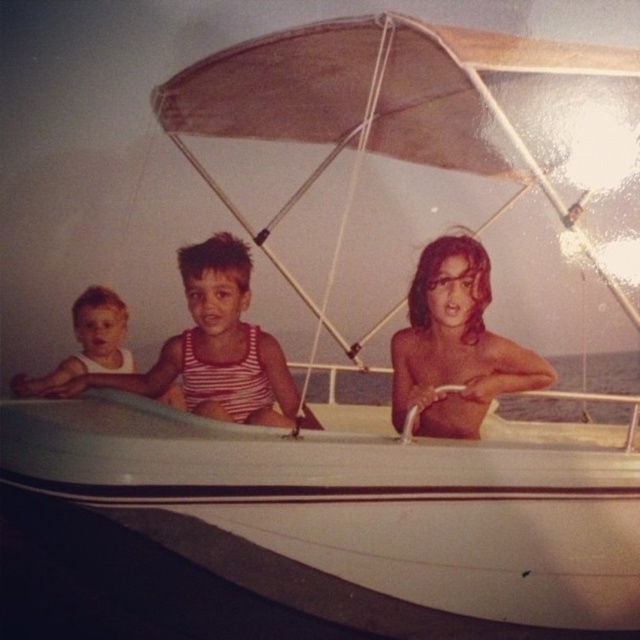
You are a photographer trying to capture a closeup of the shiny skin at center and the white striped tank top at center in the boat scene. Which object should you zoom in on more to ensure both are in focus?

Since the shiny skin at center is smaller than the white striped tank top at center, you should zoom in more on the shiny skin at center to ensure both are in focus.

Based on the scene described, which of the two individuals is positioned to the right of the other? Specifically, is the person wearing the white striped tank top at center located to the right of the person in the white matte tank top at left, or is it the other way around?

The white striped tank top at center is to the right of the white matte tank top at left.